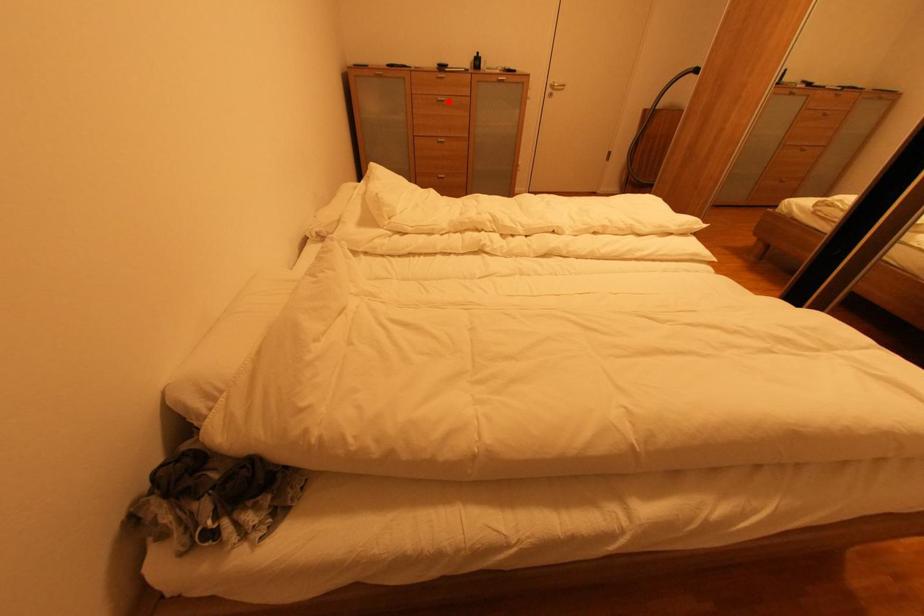
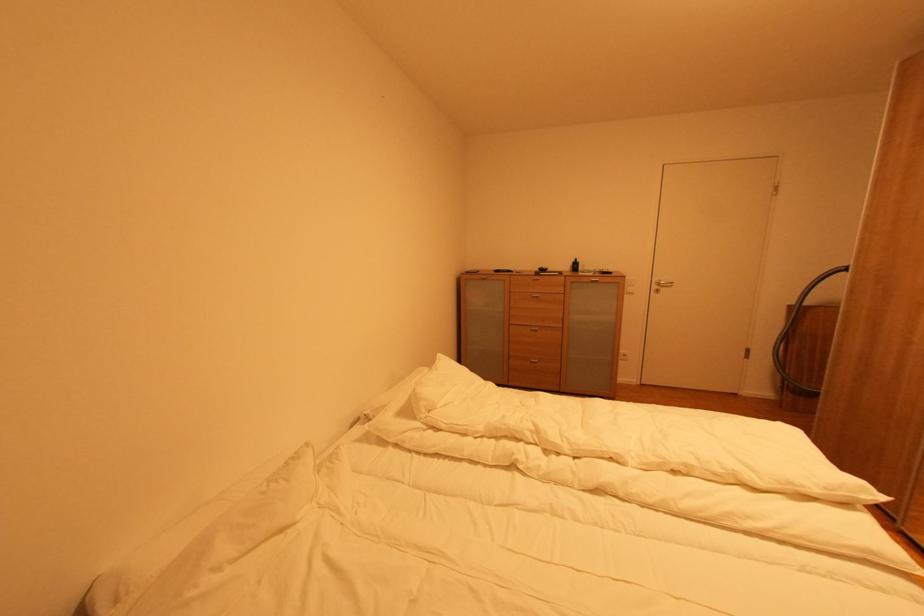
Question: I am providing you with two images of the same scene from different viewpoints. Image1 has a red point marked. In image2, the corresponding 3D location appears at what relative position? Reply with the corresponding letter.

Choices:
 (A) Closer
 (B) Farther

Answer: (B)